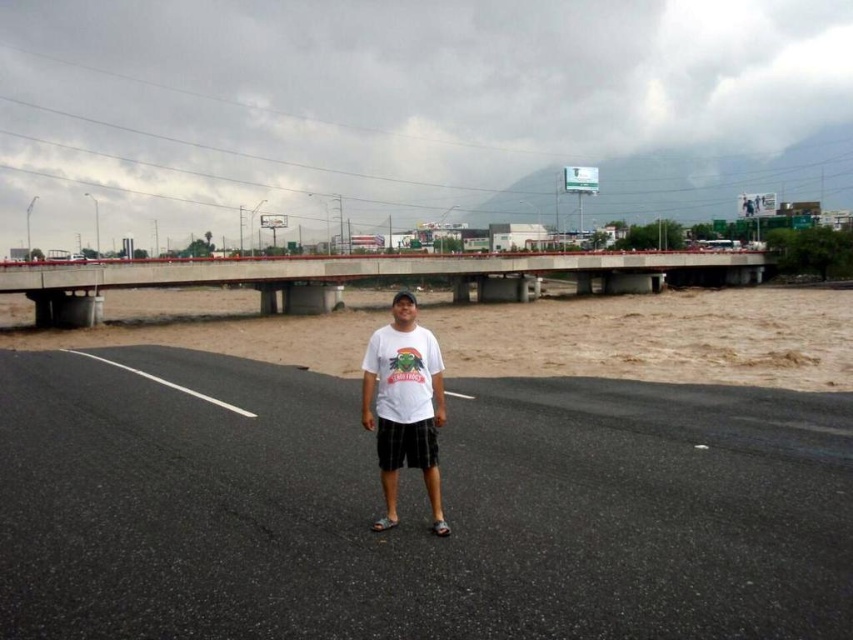
You are a drone operator tasked with capturing aerial footage of the flooded area. Your drone has a maximum flight range of 4 meters. If you are positioned where the camera is, can your drone reach the black asphalt highway at center?

The black asphalt highway at center is 3.71 meters from camera, so yes, the drone can reach it since its maximum flight range of 4 meters exceeds the distance required.

You are standing at the man on the road and want to walk towards the bridge. Which point, point (732, 618) or point (440, 508), is closer to your current position?

Point (732, 618) is closer to your current position because it is in front of point (440, 508).